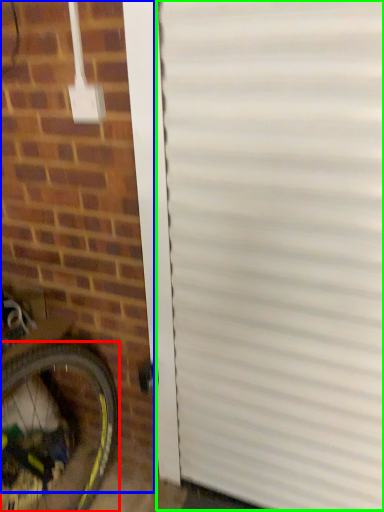
Question: Considering the real-world distances, which object is closest to bicycle wheel (highlighted by a red box)? brickwork (highlighted by a blue box) or garage door (highlighted by a green box).

Choices:
 (A) brickwork
 (B) garage door

Answer: (A)